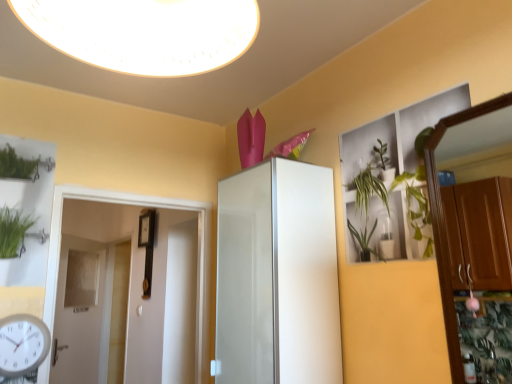
Question: Would you say white plastic clock at lower left is outside white glossy light fixture at upper center?

Choices:
 (A) yes
 (B) no

Answer: (A)

Question: Does white plastic clock at lower left appear on the right side of white glossy light fixture at upper center?

Choices:
 (A) no
 (B) yes

Answer: (A)

Question: Does white plastic clock at lower left lie in front of white glossy light fixture at upper center?

Choices:
 (A) no
 (B) yes

Answer: (A)

Question: Can you confirm if white plastic clock at lower left is bigger than white glossy light fixture at upper center?

Choices:
 (A) yes
 (B) no

Answer: (B)

Question: From a real-world perspective, is white plastic clock at lower left under white glossy light fixture at upper center?

Choices:
 (A) no
 (B) yes

Answer: (B)

Question: Can you confirm if white plastic clock at lower left is smaller than white glossy light fixture at upper center?

Choices:
 (A) no
 (B) yes

Answer: (B)

Question: Could you tell me if white plastic clock at lower left is facing white glossy door at left, positioned as the 2th door in left-to-right order?

Choices:
 (A) no
 (B) yes

Answer: (A)

Question: Is white plastic clock at lower left oriented away from white glossy door at left, marked as the 1th door in a right-to-left arrangement?

Choices:
 (A) yes
 (B) no

Answer: (B)

Question: Is white plastic clock at lower left directly adjacent to white glossy door at left, positioned as the 2th door in left-to-right order?

Choices:
 (A) yes
 (B) no

Answer: (B)

Question: From the image's perspective, is white plastic clock at lower left under white glossy door at left, marked as the 1th door in a right-to-left arrangement?

Choices:
 (A) yes
 (B) no

Answer: (A)

Question: From a real-world perspective, is white plastic clock at lower left under white glossy door at left, positioned as the 1th door in front-to-back order?

Choices:
 (A) yes
 (B) no

Answer: (A)

Question: Can you confirm if white plastic clock at lower left is smaller than white glossy door at left, marked as the 1th door in a right-to-left arrangement?

Choices:
 (A) yes
 (B) no

Answer: (A)

Question: Can you confirm if white glossy light fixture at upper center is shorter than white plastic clock at lower left?

Choices:
 (A) no
 (B) yes

Answer: (B)